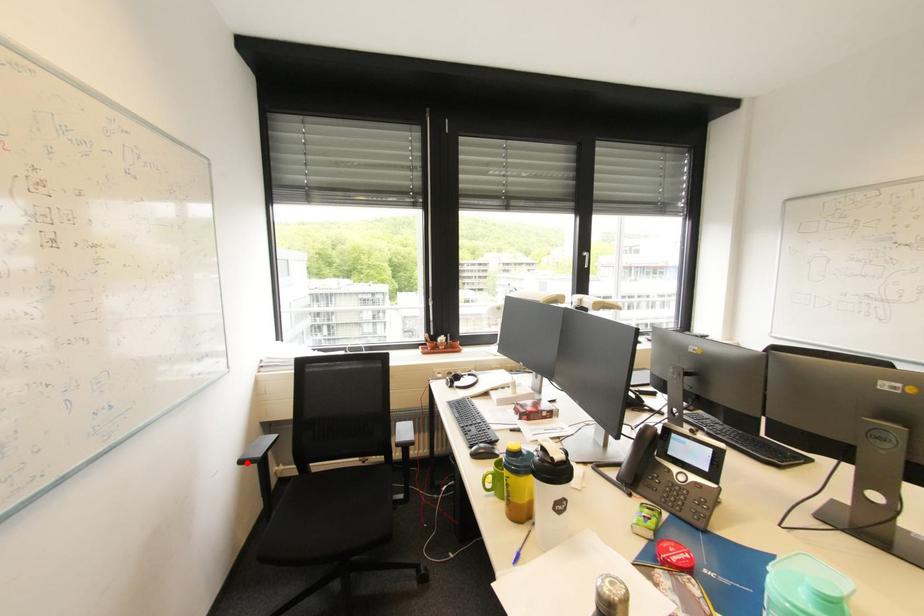
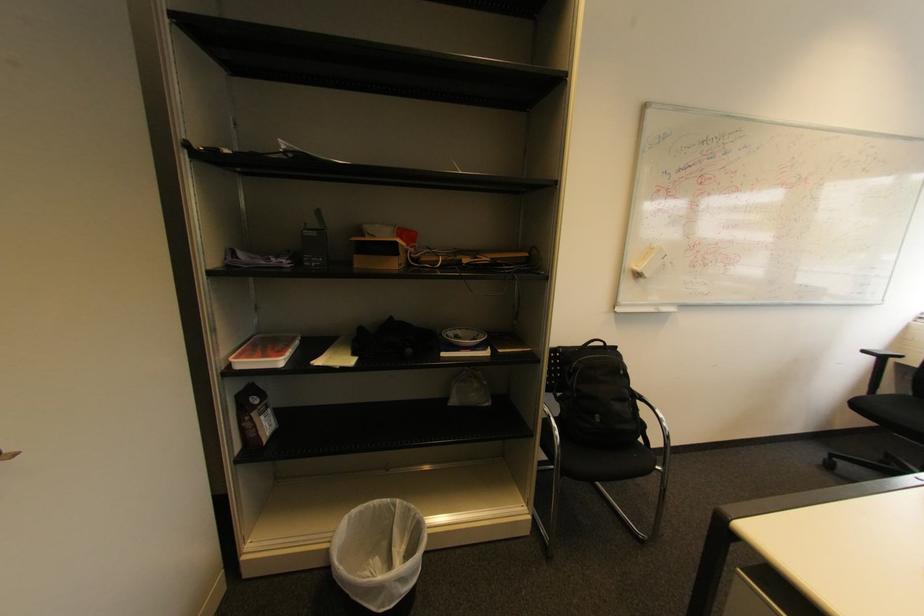
Question: I am providing you with two images of the same scene from different viewpoints. Given a red point in image1, look at the same physical point in image2. Is it:

Choices:
 (A) Closer to the viewpoint
 (B) Farther from the viewpoint

Answer: (B)